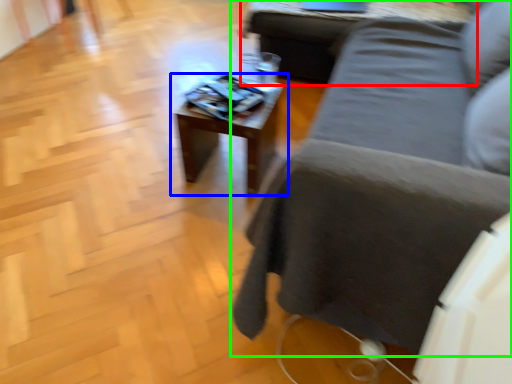
Question: Which object is positioned closest to table (highlighted by a red box)? Select from table (highlighted by a blue box) and studio couch (highlighted by a green box).

Choices:
 (A) table
 (B) studio couch

Answer: (A)